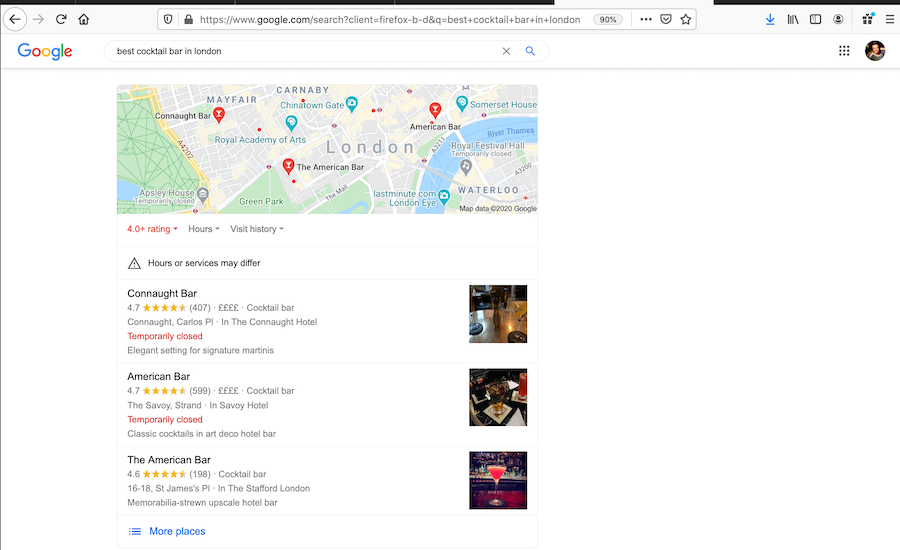
This screenshot has height=550, width=900. I want to click on images of cocktail bar, so click(x=491, y=311), click(x=489, y=392), click(x=482, y=493).